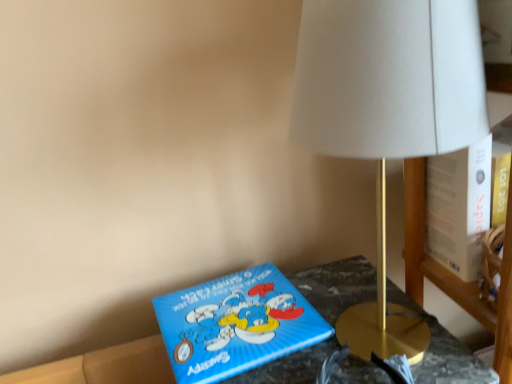
In order to click on free space to the left of gold metallic lamp at upper right in this screenshot , I will do `click(244, 334)`.